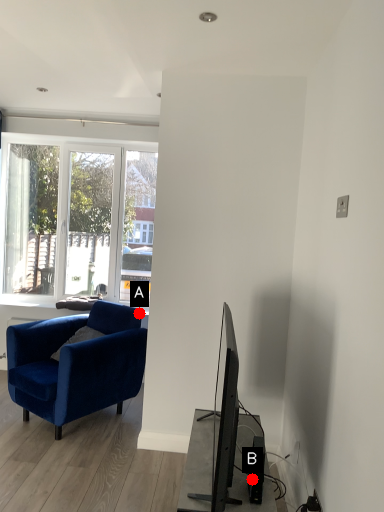
Question: Two points are circled on the image, labeled by A and B beside each circle. Which point is further to the camera?

Choices:
 (A) A is further
 (B) B is further

Answer: (A)